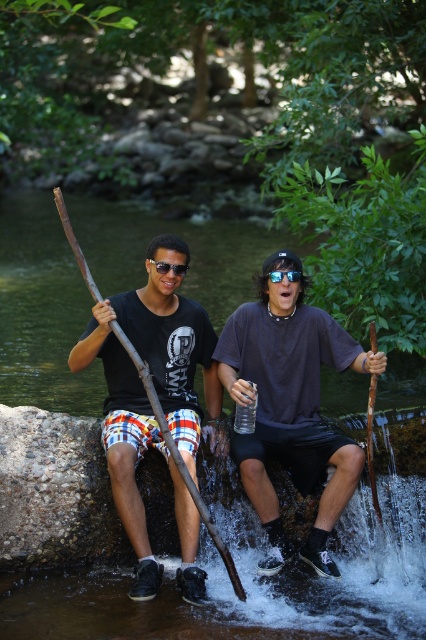
Question: Is brown wood paddle at left smaller than wooden stick at right?

Choices:
 (A) no
 (B) yes

Answer: (A)

Question: Estimate the real-world distances between objects in this image. Which object is farther from the brown wood paddle at left?

Choices:
 (A) matte brown stick at center
 (B) wooden stick at right

Answer: (B)

Question: Which object is the closest to the brown wood paddle at left?

Choices:
 (A) matte brown stick at center
 (B) wooden stick at right

Answer: (A)

Question: Observing the image, what is the correct spatial positioning of matte brown stick at center in reference to wooden stick at right?

Choices:
 (A) above
 (B) below

Answer: (A)

Question: Which of these objects is positioned closest to the brown wood paddle at left?

Choices:
 (A) matte brown stick at center
 (B) wooden stick at right

Answer: (A)

Question: Where is matte brown stick at center located in relation to brown wood paddle at left in the image?

Choices:
 (A) below
 (B) above

Answer: (A)